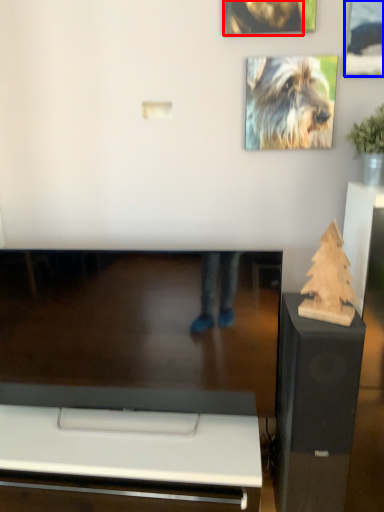
Question: Which object is further to the camera taking this photo, dog (highlighted by a red box) or picture frame (highlighted by a blue box)?

Choices:
 (A) dog
 (B) picture frame

Answer: (A)